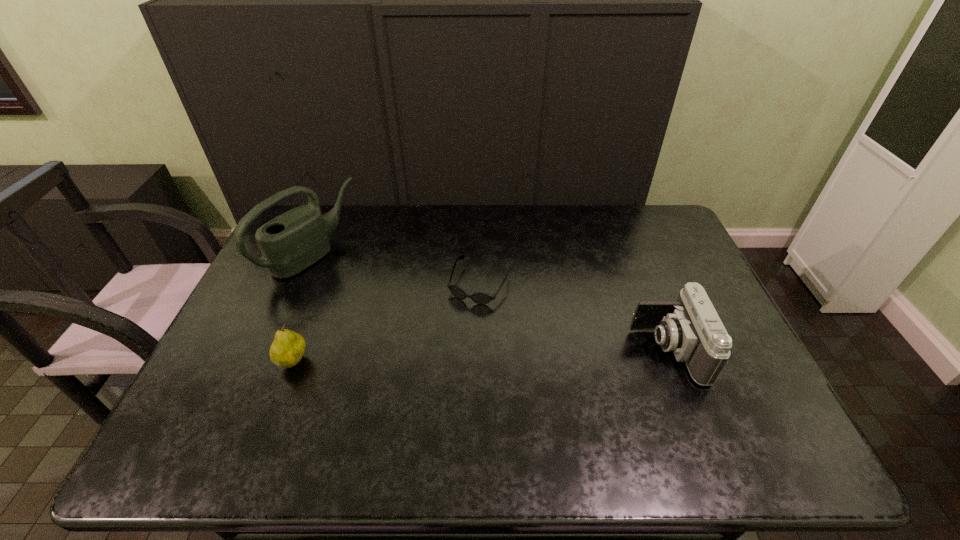
I want to click on pear, so click(x=287, y=349).

Where is `the rightmost object`? This screenshot has height=540, width=960. the rightmost object is located at coordinates [690, 327].

At what (x,y) coordinates should I click in order to perform the action: click on watering can. Please return your answer as a coordinate pair (x, y). This screenshot has height=540, width=960. Looking at the image, I should click on point(293,241).

The height and width of the screenshot is (540, 960). I want to click on sunglasses, so click(x=481, y=298).

Locate an element on the screen. The height and width of the screenshot is (540, 960). the second object from right to left is located at coordinates (481, 298).

You are a GUI agent. You are given a task and a screenshot of the screen. Output one action in this format:
    pyautogui.click(x=<x>, y=<y>)
    Task: Click on the vacant space located on the front of the third tallest object
    
    Given the screenshot: What is the action you would take?
    pyautogui.click(x=280, y=397)

Locate an element on the screen. This screenshot has height=540, width=960. vacant space located at the front of the rightmost object with an open lens cover is located at coordinates (x=484, y=350).

The height and width of the screenshot is (540, 960). In order to click on blank space located at the front of the rightmost object with an open lens cover in this screenshot , I will do `click(544, 350)`.

Where is `free location located at the front of the rightmost object with an open lens cover`? This screenshot has width=960, height=540. free location located at the front of the rightmost object with an open lens cover is located at coordinates (559, 350).

The height and width of the screenshot is (540, 960). I want to click on vacant area situated 0.390m on the spout of the tallest object, so click(431, 332).